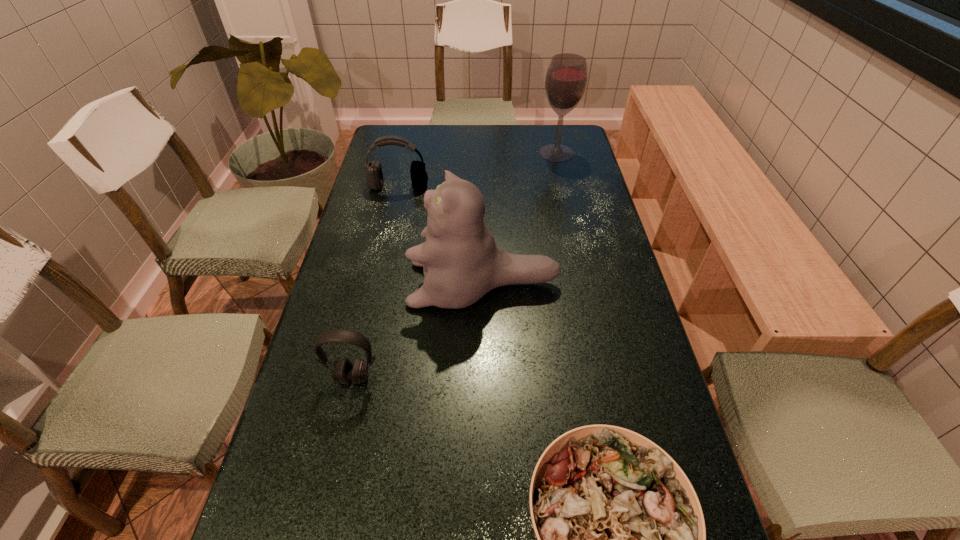
Where is `alcohol`? This screenshot has width=960, height=540. alcohol is located at coordinates (566, 78).

Find the location of `the third farthest object`. the third farthest object is located at coordinates (461, 263).

Image resolution: width=960 pixels, height=540 pixels. Identify the location of the fourth nearest object. (374, 177).

The width and height of the screenshot is (960, 540). Find the location of `the nearer headset`. the nearer headset is located at coordinates (344, 372).

I want to click on free location located on the front of the alcohol, so click(x=564, y=184).

At what (x,y) coordinates should I click in order to perform the action: click on free space located 0.180m on the face of the third nearest object. Please return your answer as a coordinate pair (x, y). The height and width of the screenshot is (540, 960). Looking at the image, I should click on (342, 284).

This screenshot has height=540, width=960. Find the location of `free space located 0.060m on the face of the third nearest object`. free space located 0.060m on the face of the third nearest object is located at coordinates (387, 284).

Where is `blank space located 0.170m on the face of the third nearest object`? blank space located 0.170m on the face of the third nearest object is located at coordinates 346,284.

Locate an element on the screen. vacant region located 0.110m on the headband of the farther headset is located at coordinates (393, 212).

Find the location of a particular element. vacant space situated on the front-facing side of the nearer headset is located at coordinates (337, 450).